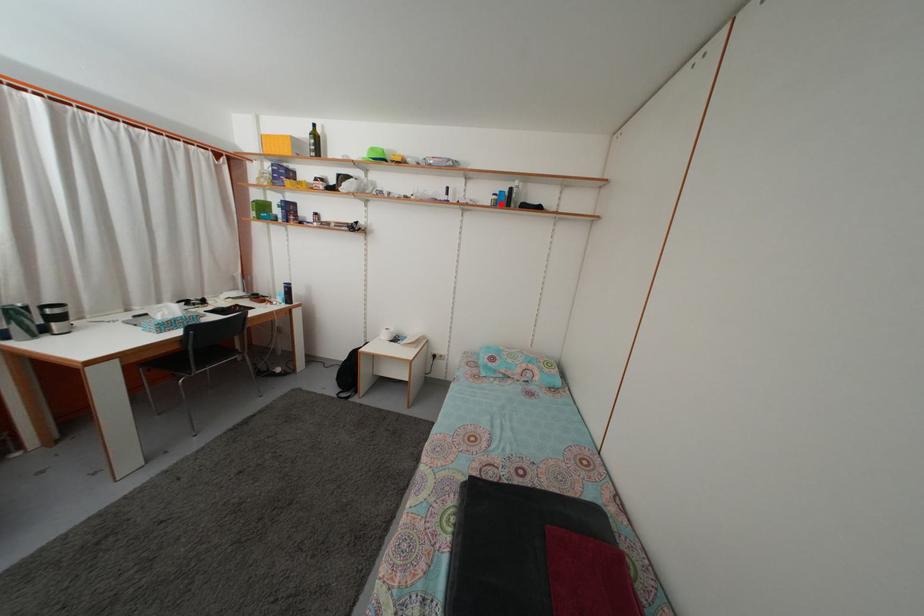
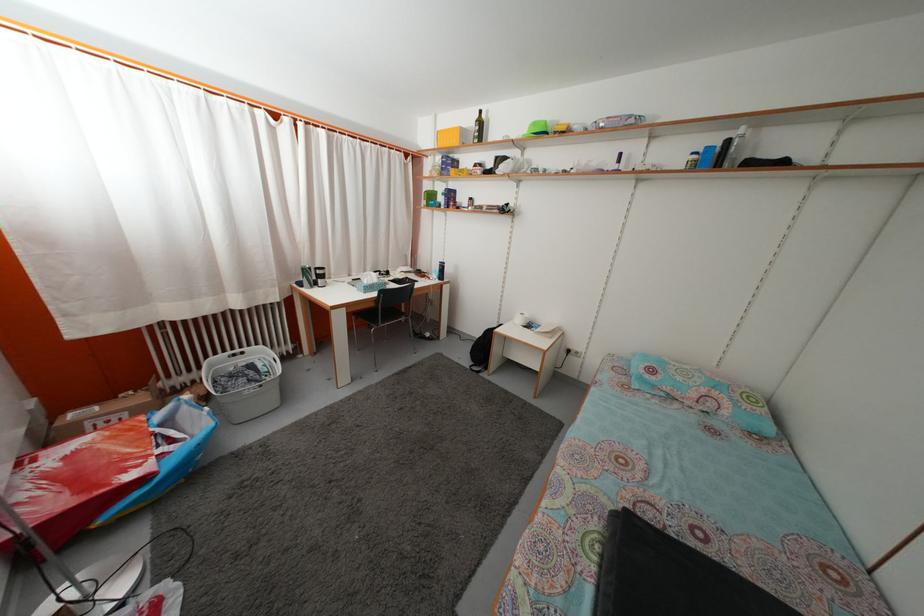
Where in the second image is the point corresponding to the highlighted location from the first image?

(699, 164)